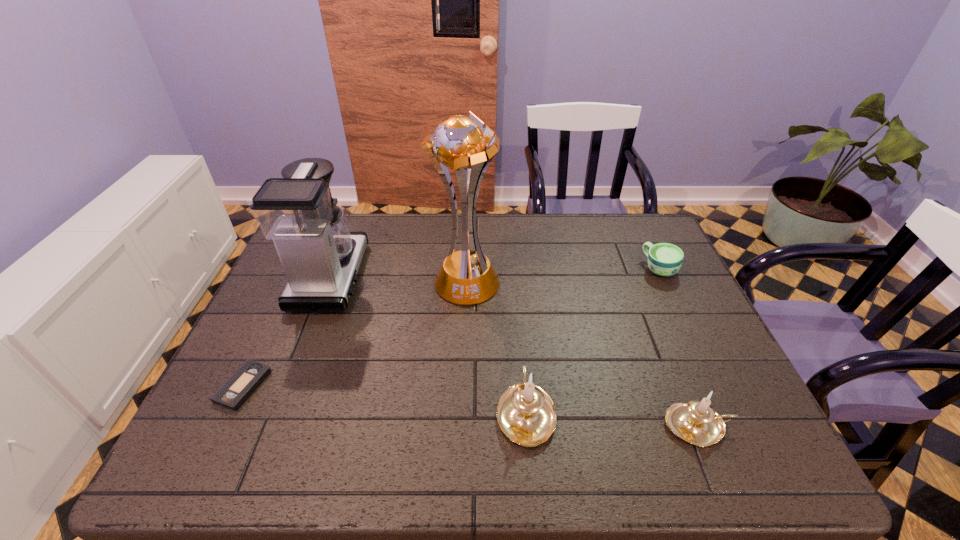
Image resolution: width=960 pixels, height=540 pixels. I want to click on videotape present at the left edge, so click(234, 392).

Image resolution: width=960 pixels, height=540 pixels. I want to click on candle holder located at the right edge, so click(696, 422).

Where is `cup that is at the right edge`? cup that is at the right edge is located at coordinates (664, 259).

Identify the location of object at the far left corner. The width and height of the screenshot is (960, 540). pos(320,256).

The image size is (960, 540). Identify the location of object at the near left corner. (234, 392).

Identify the location of object located at the far right corner. This screenshot has width=960, height=540. (664, 259).

The height and width of the screenshot is (540, 960). What are the coordinates of `object located in the near right corner section of the desktop` in the screenshot? It's located at (696, 422).

Where is `free space at the far edge of the desktop`? free space at the far edge of the desktop is located at coordinates (545, 236).

Identify the location of vacant region at the near edge. Image resolution: width=960 pixels, height=540 pixels. (653, 399).

In the image, there is a desktop. Identify the location of free region at the far right corner. (651, 232).